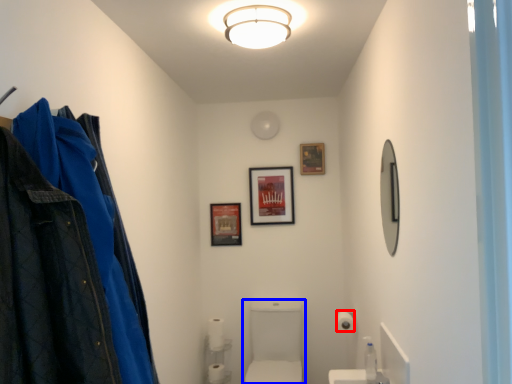
Question: Which object appears farthest to the camera in this image, toilet paper (highlighted by a red box) or sink (highlighted by a blue box)?

Choices:
 (A) toilet paper
 (B) sink

Answer: (A)